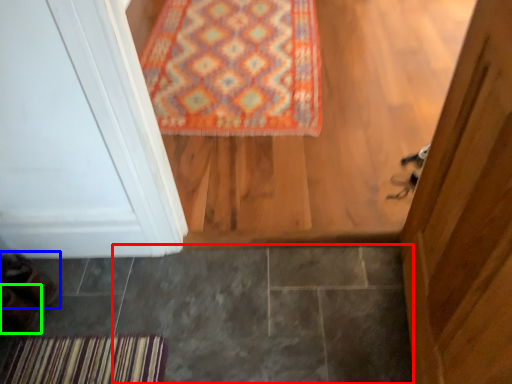
Question: Based on their relative distances, which object is nearer to tile (highlighted by a red box)? Choose from shoe (highlighted by a blue box) and shoe (highlighted by a green box).

Choices:
 (A) shoe
 (B) shoe

Answer: (A)